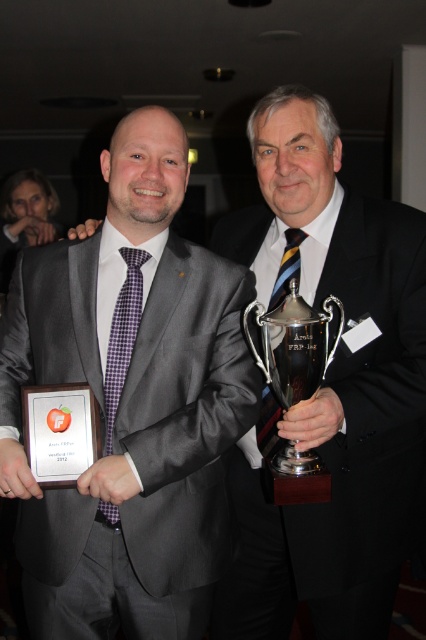
You are an event planner trying to arrange a photo shoot for the two men in the image. You need to place a backdrop exactly 1 meter behind the gray wool suit at center. Where should you position the backdrop relative to the man on the left and the man on the right?

The gray wool suit at center is positioned at point (184, 413). To place the backdrop exactly 1 meter behind this point, the backdrop should be positioned 1 meter behind the gray wool suit at center, which is equidistant from both the man on the left and the man on the right if they are symmetrically arranged around the center point. However, since the exact positions of the men aren